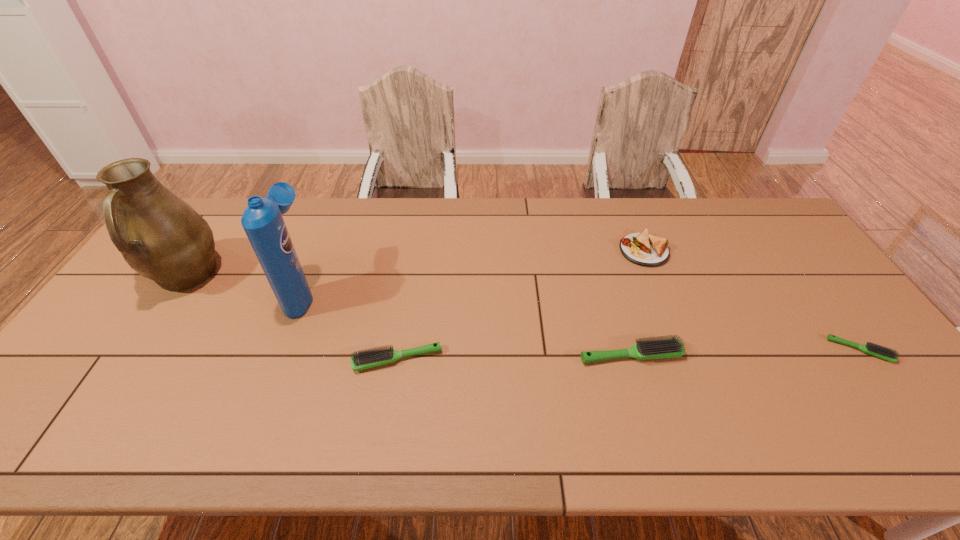
This screenshot has height=540, width=960. Identify the location of blank space located 0.110m on the front of the rightmost hairbrush. (900, 404).

What are the coordinates of `vacant region located on the left of the sandwich` in the screenshot? It's located at (560, 251).

You are a GUI agent. You are given a task and a screenshot of the screen. Output one action in this format:
    pyautogui.click(x=<x>, y=<y>)
    Task: Click on the vacant space situated 0.230m on the front of the fifth object from right to left
    
    Given the screenshot: What is the action you would take?
    coord(263,394)

I want to click on free space located 0.110m on the handle side of the leftmost object, so click(x=144, y=339).

Where is `object located at the far edge`? object located at the far edge is located at coordinates (644, 249).

Identify the location of object at the left edge. The image size is (960, 540). (160, 236).

The width and height of the screenshot is (960, 540). I want to click on object at the right edge, so click(870, 348).

Identify the location of vacant area at the far edge of the desktop. This screenshot has height=540, width=960. (409, 230).

The width and height of the screenshot is (960, 540). In the image, there is a desktop. In order to click on free region at the near edge in this screenshot , I will do `click(146, 408)`.

Locate an element on the screen. The width and height of the screenshot is (960, 540). free location at the left edge is located at coordinates (159, 288).